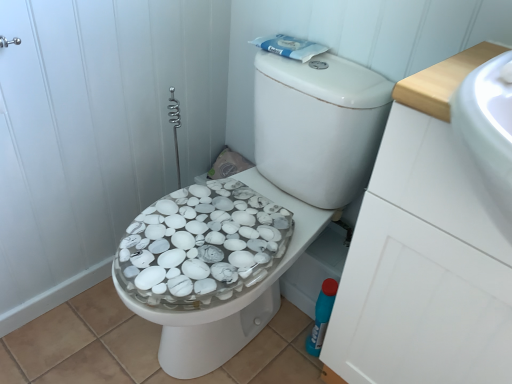
Question: Is white marble bidet at center spatially inside white glossy drawer at right, or outside of it?

Choices:
 (A) inside
 (B) outside

Answer: (B)

Question: Is white marble bidet at center in front of or behind white glossy drawer at right in the image?

Choices:
 (A) behind
 (B) front

Answer: (A)

Question: Does point (267, 286) appear closer or farther from the camera than point (486, 322)?

Choices:
 (A) farther
 (B) closer

Answer: (A)

Question: From a real-world perspective, relative to white marble bidet at center, is white glossy drawer at right vertically above or below?

Choices:
 (A) below
 (B) above

Answer: (B)

Question: From the image's perspective, is white glossy drawer at right above or below white marble bidet at center?

Choices:
 (A) below
 (B) above

Answer: (B)

Question: Is white glossy drawer at right bigger or smaller than white marble bidet at center?

Choices:
 (A) small
 (B) big

Answer: (B)

Question: Considering the relative positions of white glossy drawer at right and white marble bidet at center in the image provided, is white glossy drawer at right to the left or to the right of white marble bidet at center?

Choices:
 (A) left
 (B) right

Answer: (B)